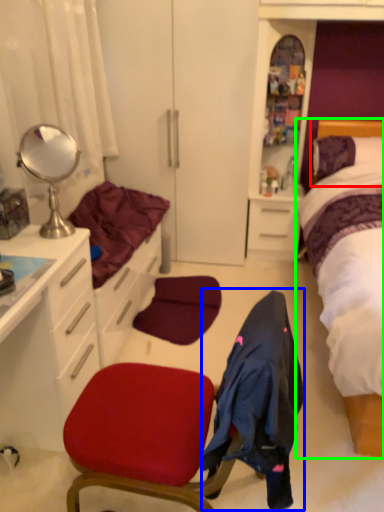
Question: Considering the real-world distances, which object is farthest from headboard (highlighted by a red box)? clothing (highlighted by a blue box) or bed (highlighted by a green box)?

Choices:
 (A) clothing
 (B) bed

Answer: (A)